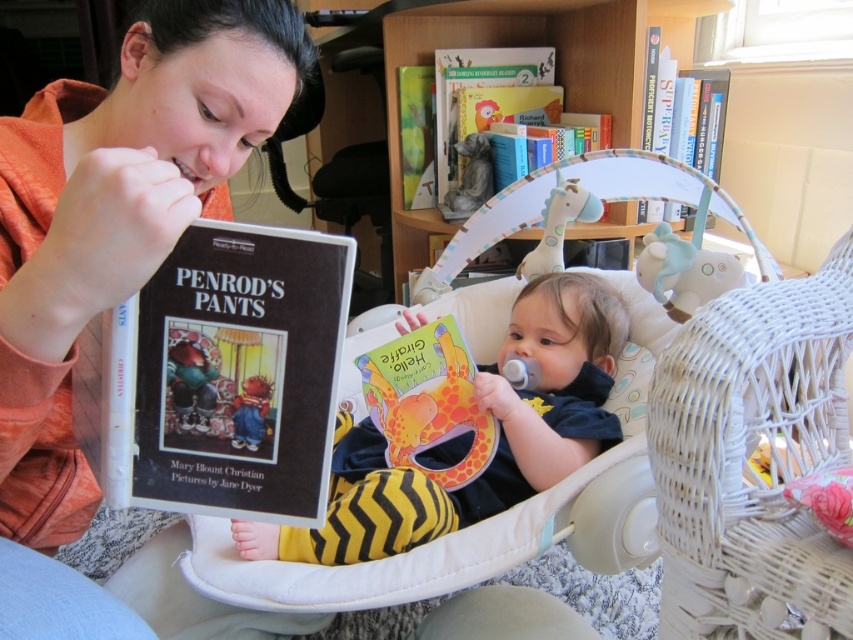
Question: Which object is closer to the camera taking this photo?

Choices:
 (A) yellow zigzag pants at center
 (B) matte black book at left

Answer: (B)

Question: Which object is positioned closest to the wooden bookshelf at upper center?

Choices:
 (A) matte orange sweatshirt at upper left
 (B) rubber teething ring at upper center

Answer: (A)

Question: Is white wicker baby carriage at center above yellow zigzag pants at center?

Choices:
 (A) no
 (B) yes

Answer: (B)

Question: Can you confirm if yellow zigzag pants at center is positioned above hardcover book at upper right?

Choices:
 (A) yes
 (B) no

Answer: (B)

Question: Which of the following is the farthest from the observer?

Choices:
 (A) (148, 628)
 (B) (177, 164)

Answer: (B)

Question: In this image, where is matte orange sweatshirt at upper left located relative to white wicker feeding chair at center?

Choices:
 (A) left
 (B) right

Answer: (A)